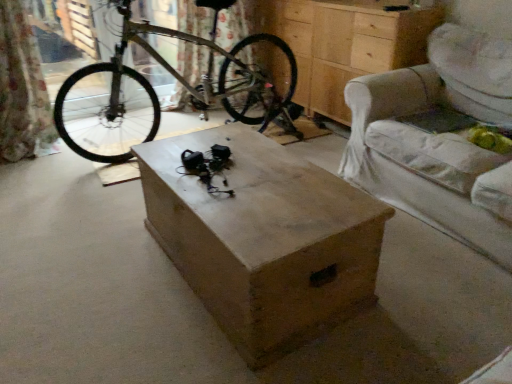
This screenshot has width=512, height=384. What do you see at coordinates (156, 94) in the screenshot?
I see `silver metallic bicycle at center` at bounding box center [156, 94].

Where is `silver metallic bicycle at center`? This screenshot has height=384, width=512. silver metallic bicycle at center is located at coordinates (156, 94).

Where is `light beige fabric armchair at right`? This screenshot has width=512, height=384. light beige fabric armchair at right is located at coordinates (442, 132).

Find the location of a particular element. The width and height of the screenshot is (512, 384). silver metallic bicycle at center is located at coordinates (156, 94).

Which of these two, wooden chest of drawers at center or wooden box at center, stands shorter?

With less height is wooden box at center.

Is wooden chest of drawers at center further to the viewer compared to wooden box at center?

Yes, wooden chest of drawers at center is further from the camera.

Considering the positions of objects wooden chest of drawers at center and wooden box at center in the image provided, who is more to the left, wooden chest of drawers at center or wooden box at center?

wooden box at center is more to the left.

Choose the correct answer: Is wooden chest of drawers at center inside wooden box at center or outside it?

wooden chest of drawers at center lies outside wooden box at center.

From a real-world perspective, is light beige fabric armchair at right physically above wooden box at center?

Yes, from a real-world perspective, light beige fabric armchair at right is on top of wooden box at center.

Is light beige fabric armchair at right not near wooden box at center?

Actually, light beige fabric armchair at right and wooden box at center are a little close together.

Considering the positions of point (485, 189) and point (330, 208), is point (485, 189) closer or farther from the camera than point (330, 208)?

Point (485, 189) appears to be farther away from the viewer than point (330, 208).

The image size is (512, 384). Find the location of `table below the light beige fabric armchair at right (from a real-world perspective)`. table below the light beige fabric armchair at right (from a real-world perspective) is located at coordinates (264, 240).

In the scene shown: Can you confirm if silver metallic bicycle at center is bigger than wooden box at center?

Indeed, silver metallic bicycle at center has a larger size compared to wooden box at center.

Is silver metallic bicycle at center far away from wooden box at center?

Yes.

In terms of height, does silver metallic bicycle at center look taller or shorter compared to wooden box at center?

Clearly, silver metallic bicycle at center is taller compared to wooden box at center.

From a real-world perspective, which is physically above, wooden chest of drawers at center or silver metallic bicycle at center?

silver metallic bicycle at center.

Consider the image. Which object is positioned more to the left, wooden chest of drawers at center or silver metallic bicycle at center?

silver metallic bicycle at center is more to the left.

In the image, is wooden chest of drawers at center positioned in front of or behind silver metallic bicycle at center?

wooden chest of drawers at center is behind silver metallic bicycle at center.

Considering the points (333, 59) and (93, 105), which point is in front, point (333, 59) or point (93, 105)?

The point (333, 59) is more forward.

How different are the orientations of wooden box at center and wooden chest of drawers at center in degrees?

The angular difference between wooden box at center and wooden chest of drawers at center is 1.16 degrees.

From a real-world perspective, relative to wooden chest of drawers at center, is wooden box at center vertically above or below?

In terms of real-world spatial position, wooden box at center is below wooden chest of drawers at center.

Is wooden box at center in contact with wooden chest of drawers at center?

No.

From the image's perspective, is wooden box at center located above wooden chest of drawers at center?

No, from the image's perspective, wooden box at center is not above wooden chest of drawers at center.

Is light beige fabric armchair at right facing towards silver metallic bicycle at center?

No, light beige fabric armchair at right is not turned towards silver metallic bicycle at center.

Who is shorter, light beige fabric armchair at right or silver metallic bicycle at center?

light beige fabric armchair at right.

Is light beige fabric armchair at right thinner than silver metallic bicycle at center?

Yes.

Image resolution: width=512 pixels, height=384 pixels. What are the coordinates of `bicycle above the light beige fabric armchair at right (from the image's perspective)` in the screenshot? It's located at (156, 94).

Is silver metallic bicycle at center oriented towards light beige fabric armchair at right?

No, silver metallic bicycle at center is not aimed at light beige fabric armchair at right.

Is light beige fabric armchair at right located within silver metallic bicycle at center?

That's incorrect, light beige fabric armchair at right is not inside silver metallic bicycle at center.

Which object is closer to the camera, silver metallic bicycle at center or light beige fabric armchair at right?

Positioned in front is light beige fabric armchair at right.

Does silver metallic bicycle at center have a larger size compared to light beige fabric armchair at right?

Correct, silver metallic bicycle at center is larger in size than light beige fabric armchair at right.

The image size is (512, 384). What are the coordinates of `table below the wooden chest of drawers at center (from a real-world perspective)` in the screenshot? It's located at (264, 240).

Image resolution: width=512 pixels, height=384 pixels. In the image, there is a wooden box at center. What are the coordinates of `armchair above it (from the image's perspective)` in the screenshot? It's located at (442, 132).

Which object lies further to the anchor point light beige fabric armchair at right, wooden chest of drawers at center or silver metallic bicycle at center?

The object further to light beige fabric armchair at right is silver metallic bicycle at center.

When comparing their distances from light beige fabric armchair at right, does wooden box at center or wooden chest of drawers at center seem closer?

wooden chest of drawers at center lies closer to light beige fabric armchair at right than the other object.

Which object lies nearer to the anchor point silver metallic bicycle at center, wooden chest of drawers at center or light beige fabric armchair at right?

wooden chest of drawers at center is positioned closer to the anchor silver metallic bicycle at center.

Based on the photo, considering their positions, is wooden chest of drawers at center positioned closer to wooden box at center than silver metallic bicycle at center?

silver metallic bicycle at center is positioned closer to the anchor wooden box at center.

Estimate the real-world distances between objects in this image. Which object is further from silver metallic bicycle at center, wooden box at center or wooden chest of drawers at center?

Based on the image, wooden box at center appears to be further to silver metallic bicycle at center.

Considering their positions, is wooden box at center positioned further to silver metallic bicycle at center than light beige fabric armchair at right?

light beige fabric armchair at right is positioned further to the anchor silver metallic bicycle at center.

From the image, which object appears to be nearer to wooden box at center, silver metallic bicycle at center or light beige fabric armchair at right?

light beige fabric armchair at right is positioned closer to the anchor wooden box at center.

Considering their positions, is light beige fabric armchair at right positioned closer to silver metallic bicycle at center than wooden chest of drawers at center?

The object closer to silver metallic bicycle at center is wooden chest of drawers at center.

What are the coordinates of `bicycle between wooden box at center and wooden chest of drawers at center along the z-axis` in the screenshot? It's located at tap(156, 94).

The height and width of the screenshot is (384, 512). What are the coordinates of `armchair between wooden box at center and wooden chest of drawers at center along the z-axis` in the screenshot? It's located at pyautogui.click(x=442, y=132).

Find the location of a particular element. table between silver metallic bicycle at center and light beige fabric armchair at right in the horizontal direction is located at coordinates (264, 240).

What are the coordinates of `chest of drawers between silver metallic bicycle at center and light beige fabric armchair at right from left to right` in the screenshot? It's located at (346, 45).